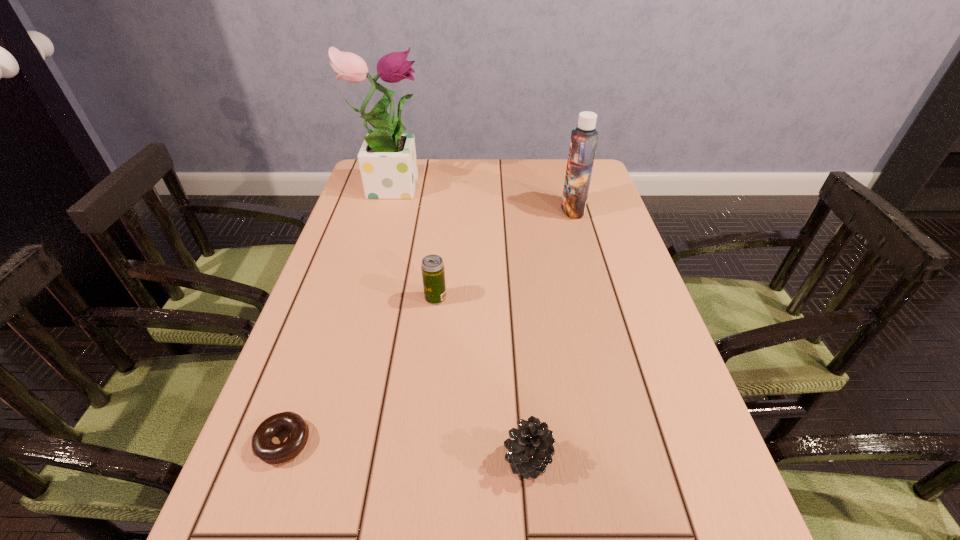
The width and height of the screenshot is (960, 540). Find the location of `flower arrangement`. flower arrangement is located at coordinates (387, 159).

The width and height of the screenshot is (960, 540). What are the coordinates of `the fourth shortest object` in the screenshot? It's located at (583, 142).

Identify the location of shampoo. tap(583, 142).

Image resolution: width=960 pixels, height=540 pixels. Find the location of `the third object from right to left`. the third object from right to left is located at coordinates (433, 274).

Identify the location of beer can. (433, 274).

You are a GUI agent. You are given a task and a screenshot of the screen. Output one action in this format:
    pyautogui.click(x=<x>, y=<y>)
    Task: Click on the second object from right to left
    This screenshot has width=960, height=540.
    Given the screenshot: What is the action you would take?
    pyautogui.click(x=531, y=450)

Find the location of a particular element. The image size is (960, 540). the shortest object is located at coordinates (262, 446).

What are the coordinates of `vacant space located on the front-facing side of the flower arrangement` in the screenshot? It's located at (501, 185).

The height and width of the screenshot is (540, 960). Find the location of `vacant space located 0.190m on the front label of the fourth shortest object`. vacant space located 0.190m on the front label of the fourth shortest object is located at coordinates (498, 209).

At what (x,y) coordinates should I click in order to perform the action: click on vacant area situated 0.250m on the front label of the fourth shortest object. Please return your answer as a coordinate pair (x, y). The height and width of the screenshot is (540, 960). Looking at the image, I should click on (478, 209).